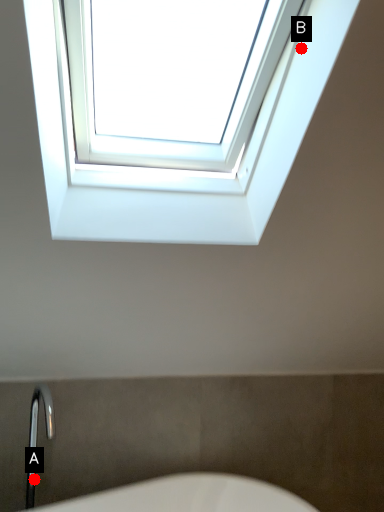
Question: Two points are circled on the image, labeled by A and B beside each circle. Which point is closer to the camera?

Choices:
 (A) A is closer
 (B) B is closer

Answer: (B)